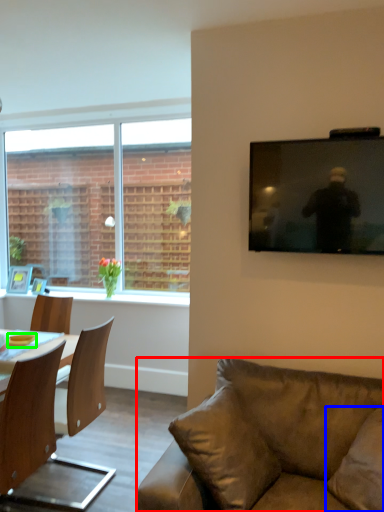
Question: Which object is the closest to the studio couch (highlighted by a red box)? Choose among these: pillow (highlighted by a blue box) or bowl (highlighted by a green box).

Choices:
 (A) pillow
 (B) bowl

Answer: (A)